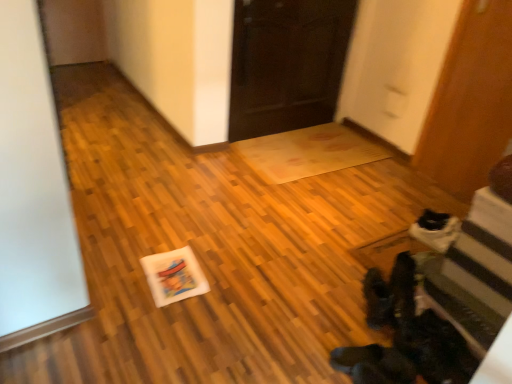
Question: Should I look upward or downward to see white matte postcard at center?

Choices:
 (A) down
 (B) up

Answer: (A)

Question: Is white matte postcard at center taller than dark wood door at center, which appears as the 1th door when viewed from the left?

Choices:
 (A) no
 (B) yes

Answer: (A)

Question: Is white matte postcard at center touching dark wood door at center, which appears as the 1th door when viewed from the left?

Choices:
 (A) yes
 (B) no

Answer: (B)

Question: Can you confirm if white matte postcard at center is thinner than dark wood door at center, placed as the 2th door when sorted from right to left?

Choices:
 (A) no
 (B) yes

Answer: (A)

Question: Is there a large distance between white matte postcard at center and dark wood door at center, which appears as the 1th door when viewed from the left?

Choices:
 (A) no
 (B) yes

Answer: (B)

Question: From a real-world perspective, is white matte postcard at center under dark wood door at center, which appears as the 1th door when viewed from the left?

Choices:
 (A) no
 (B) yes

Answer: (B)

Question: Is the depth of white matte postcard at center less than that of dark wood door at center, placed as the 2th door when sorted from right to left?

Choices:
 (A) yes
 (B) no

Answer: (A)

Question: Can you confirm if black suede boots at lower right is positioned to the left of white matte postcard at center?

Choices:
 (A) no
 (B) yes

Answer: (A)

Question: Does black suede boots at lower right turn towards white matte postcard at center?

Choices:
 (A) yes
 (B) no

Answer: (B)

Question: Can you see black suede boots at lower right touching white matte postcard at center?

Choices:
 (A) no
 (B) yes

Answer: (A)

Question: From the image's perspective, would you say black suede boots at lower right is positioned over white matte postcard at center?

Choices:
 (A) no
 (B) yes

Answer: (A)

Question: Is black suede boots at lower right not near white matte postcard at center?

Choices:
 (A) yes
 (B) no

Answer: (B)

Question: Does black suede boots at lower right lie behind white matte postcard at center?

Choices:
 (A) yes
 (B) no

Answer: (B)

Question: Would you say wooden door at right, which ranks as the second door in left-to-right order, is part of dark wood door at center, which appears as the 1th door when viewed from the left,'s contents?

Choices:
 (A) no
 (B) yes

Answer: (A)